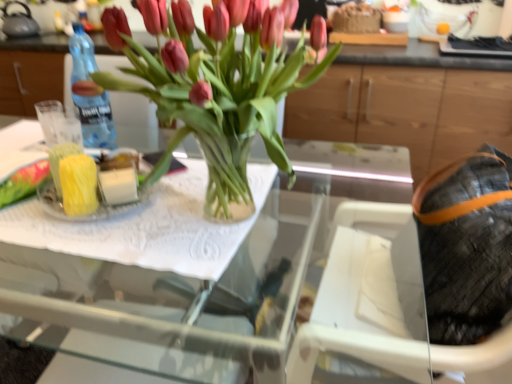
In order to face blue plastic bottle at left, should I rotate leftwards or rightwards?

Rotate your view left by about 21.343°.

Identify the location of blue plastic bottle at left. (90, 93).

From the image's perspective, is wooden cabinet at upper center positioned above or below clear glass tray at center?

From the image's perspective, wooden cabinet at upper center appears above clear glass tray at center.

Does wooden cabinet at upper center have a greater width compared to clear glass tray at center?

No.

Are wooden cabinet at upper center and clear glass tray at center making contact?

No.

Can you confirm if leather textured bag at right is taller than matte gray kettle at upper left?

Yes.

From the image's perspective, is leather textured bag at right located beneath matte gray kettle at upper left?

Yes.

Is leather textured bag at right closer to camera compared to matte gray kettle at upper left?

Yes, leather textured bag at right is closer to the camera.

From a real-world perspective, between leather textured bag at right and matte gray kettle at upper left, who is vertically lower?

In real-world perspective, leather textured bag at right is lower.

Would you say blue plastic bottle at left is a long distance from transparent glass vase at center?

blue plastic bottle at left is actually quite close to transparent glass vase at center.

Considering their positions, is blue plastic bottle at left located in front of or behind transparent glass vase at center?

blue plastic bottle at left is behind transparent glass vase at center.

Is transparent glass vase at center located within blue plastic bottle at left?

No, transparent glass vase at center is located outside of blue plastic bottle at left.

From a real-world perspective, is blue plastic bottle at left on top of transparent glass vase at center?

No.

Could you tell me if clear glass tray at center is facing leather textured bag at right?

No, clear glass tray at center is not turned towards leather textured bag at right.

Would you consider clear glass tray at center to be distant from leather textured bag at right?

clear glass tray at center is near leather textured bag at right, not far away.

Which is more to the right, clear glass tray at center or leather textured bag at right?

leather textured bag at right is more to the right.

Can you confirm if clear glass tray at center is smaller than leather textured bag at right?

Actually, clear glass tray at center might be larger than leather textured bag at right.

Measure the distance between wooden cabinet at upper center and transparent glass vase at center.

The distance of wooden cabinet at upper center from transparent glass vase at center is 1.21 meters.

Based on the photo, does wooden cabinet at upper center come in front of transparent glass vase at center?

No.

Is wooden cabinet at upper center positioned far away from transparent glass vase at center?

wooden cabinet at upper center is positioned a significant distance from transparent glass vase at center.

This screenshot has width=512, height=384. Find the location of `cabinetry that is above the transparent glass vase at center (from the image's perspective)`. cabinetry that is above the transparent glass vase at center (from the image's perspective) is located at coordinates (407, 104).

From a real-world perspective, between blue plastic bottle at left and leather textured bag at right, who is vertically lower?

leather textured bag at right is physically lower.

Is blue plastic bottle at left to the right of leather textured bag at right from the viewer's perspective?

Incorrect, blue plastic bottle at left is not on the right side of leather textured bag at right.

Is blue plastic bottle at left taller than leather textured bag at right?

Incorrect, the height of blue plastic bottle at left is not larger of that of leather textured bag at right.

Is blue plastic bottle at left beside leather textured bag at right?

There is a gap between blue plastic bottle at left and leather textured bag at right.

Considering the relative positions of leather textured bag at right and wooden cabinet at upper center in the image provided, is leather textured bag at right behind wooden cabinet at upper center?

No, it is in front of wooden cabinet at upper center.

Which of these two, leather textured bag at right or wooden cabinet at upper center, stands taller?

wooden cabinet at upper center is taller.

From a real-world perspective, is leather textured bag at right on wooden cabinet at upper center?

Correct, in the physical world, leather textured bag at right is higher than wooden cabinet at upper center.

Is leather textured bag at right bigger or smaller than wooden cabinet at upper center?

Considering their sizes, leather textured bag at right takes up less space than wooden cabinet at upper center.

In order to click on cabinetry that is behind the clear glass tray at center in this screenshot , I will do `click(407, 104)`.

What are the coordinates of `kettle on the left of leather textured bag at right` in the screenshot? It's located at (19, 22).

Based on their spatial positions, is blue plastic bottle at left or transparent glass vase at center further from clear glass tray at center?

Based on the image, blue plastic bottle at left appears to be further to clear glass tray at center.

When comparing their distances from blue plastic bottle at left, does wooden cabinet at upper center or leather textured bag at right seem further?

Among the two, wooden cabinet at upper center is located further to blue plastic bottle at left.

Estimate the real-world distances between objects in this image. Which object is further from leather textured bag at right, blue plastic bottle at left or clear glass tray at center?

The object further to leather textured bag at right is blue plastic bottle at left.

Considering their positions, is leather textured bag at right positioned closer to matte gray kettle at upper left than blue plastic bottle at left?

The object closer to matte gray kettle at upper left is blue plastic bottle at left.

Looking at the image, which one is located closer to clear glass tray at center, wooden cabinet at upper center or transparent glass vase at center?

transparent glass vase at center lies closer to clear glass tray at center than the other object.

When comparing their distances from matte gray kettle at upper left, does blue plastic bottle at left or wooden cabinet at upper center seem further?

Based on the image, wooden cabinet at upper center appears to be further to matte gray kettle at upper left.

Based on their spatial positions, is leather textured bag at right or clear glass tray at center further from blue plastic bottle at left?

leather textured bag at right is further to blue plastic bottle at left.

Consider the image. Based on their spatial positions, is transparent glass vase at center or wooden cabinet at upper center further from matte gray kettle at upper left?

Based on the image, transparent glass vase at center appears to be further to matte gray kettle at upper left.

Where is `cabinetry between matte gray kettle at upper left and leather textured bag at right from left to right`? cabinetry between matte gray kettle at upper left and leather textured bag at right from left to right is located at coordinates (407, 104).

Identify the location of houseplant situated between clear glass tray at center and leather textured bag at right from left to right. (215, 86).

Identify the location of material between clear glass tray at center and wooden cabinet at upper center along the z-axis. (467, 248).

Where is `material positioned between clear glass tray at center and matte gray kettle at upper left from near to far`? The height and width of the screenshot is (384, 512). material positioned between clear glass tray at center and matte gray kettle at upper left from near to far is located at coordinates (467, 248).